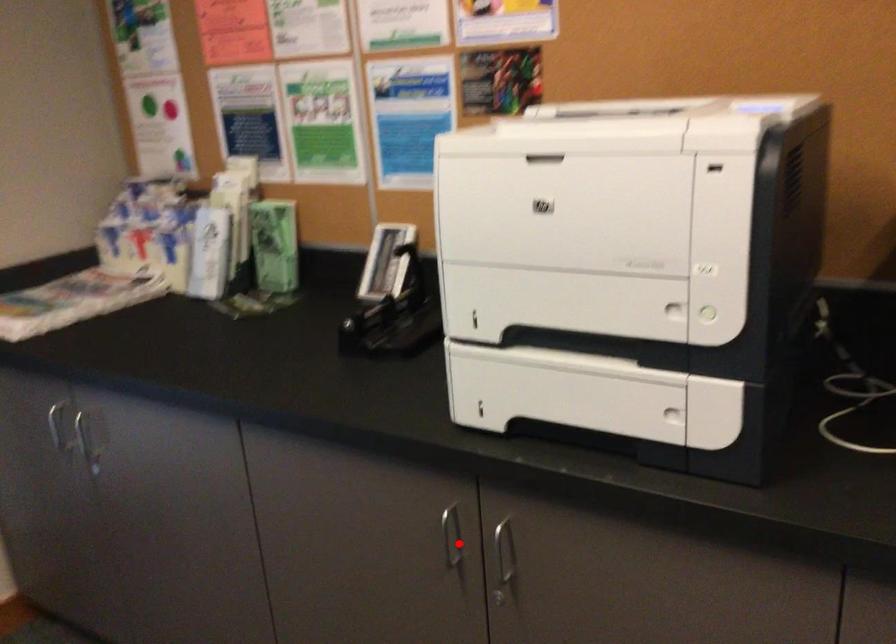
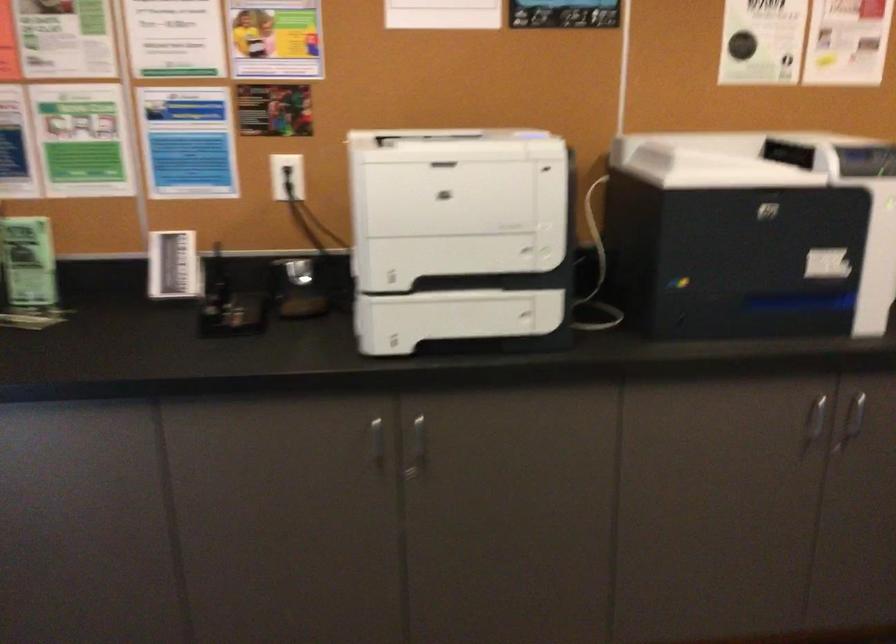
Where in the second image is the point corresponding to the highlighted location from the first image?

(376, 442)